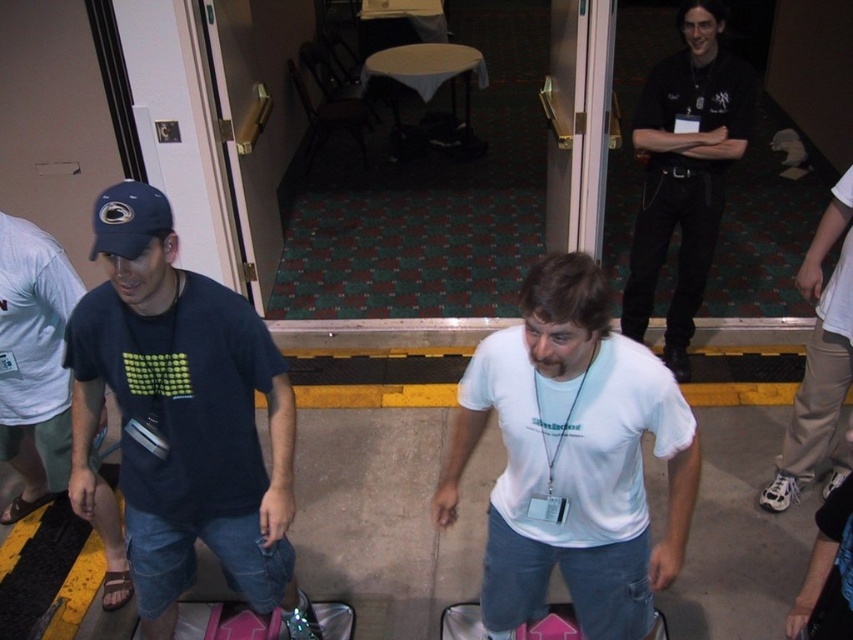
Between dark blue cotton t-shirt at left and pink plastic suitcase at lower center, which one is positioned lower?

pink plastic suitcase at lower center is lower down.

Is dark blue cotton t-shirt at left to the right of pink plastic suitcase at lower center from the viewer's perspective?

No, dark blue cotton t-shirt at left is not to the right of pink plastic suitcase at lower center.

Does point (84, 412) come in front of point (527, 621)?

Yes, it is in front of point (527, 621).

Identify the location of dark blue cotton t-shirt at left. (183, 417).

Does white matte t-shirt at center have a larger size compared to tan fabric pants at right?

Correct, white matte t-shirt at center is larger in size than tan fabric pants at right.

Is white matte t-shirt at center positioned at the back of tan fabric pants at right?

No.

What do you see at coordinates (572, 458) in the screenshot? The width and height of the screenshot is (853, 640). I see `white matte t-shirt at center` at bounding box center [572, 458].

This screenshot has width=853, height=640. I want to click on white matte t-shirt at center, so click(572, 458).

Measure the distance between black matte shirt at upper center and camera.

A distance of 3.10 meters exists between black matte shirt at upper center and camera.

Is black matte shirt at upper center wider than tan fabric pants at right?

Correct, the width of black matte shirt at upper center exceeds that of tan fabric pants at right.

Where is `black matte shirt at upper center`? This screenshot has width=853, height=640. black matte shirt at upper center is located at coordinates (685, 172).